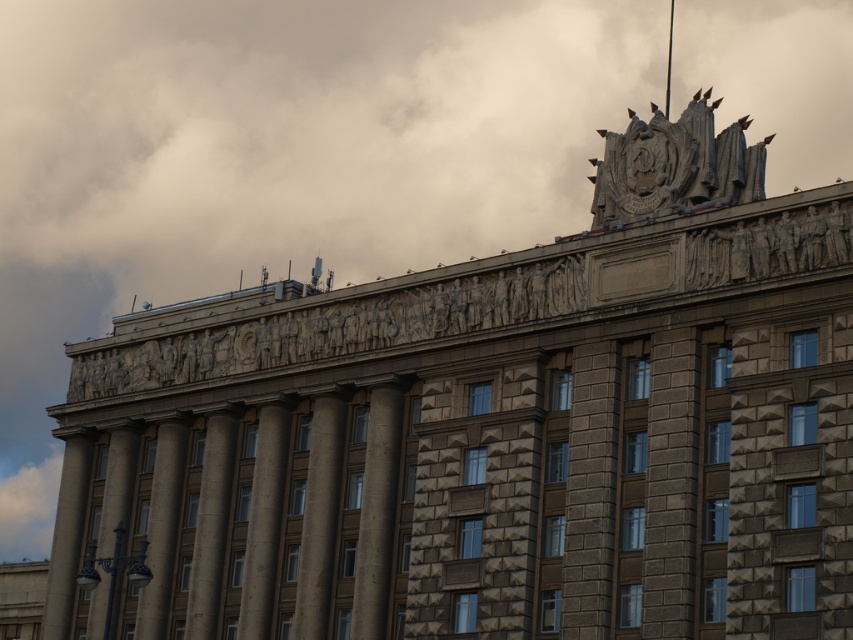
Question: Which point is farther to the camera?

Choices:
 (A) brown stone pillar at center
 (B) gray stone pillar at center
 (C) slate gray stone column at center
 (D) gray stone column at center

Answer: (C)

Question: Does gray stone pillar at center have a lesser width compared to brown stone column at center?

Choices:
 (A) no
 (B) yes

Answer: (B)

Question: Does brown stone pillar at center have a lesser width compared to brown stone column at left?

Choices:
 (A) yes
 (B) no

Answer: (A)

Question: Which point appears farthest from the camera in this image?

Choices:
 (A) (358, 572)
 (B) (155, 636)
 (C) (202, 576)
 (D) (339, 467)

Answer: (B)

Question: Among these objects, which one is nearest to the camera?

Choices:
 (A) gray stone pillar at center
 (B) gray stone column at center
 (C) slate gray stone pillar at center

Answer: (A)

Question: Is gray stone pillar at center to the right of slate gray stone column at center from the viewer's perspective?

Choices:
 (A) yes
 (B) no

Answer: (A)